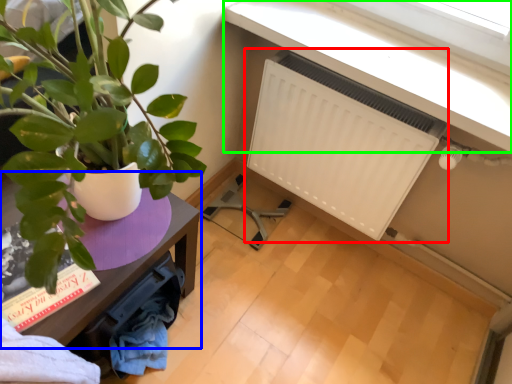
Question: Based on their relative distances, which object is farther from radiator (highlighted by a red box)? Choose from table (highlighted by a blue box) and window sill (highlighted by a green box).

Choices:
 (A) table
 (B) window sill

Answer: (A)